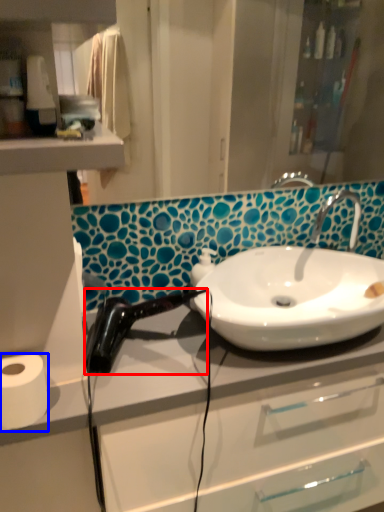
Question: Among these objects, which one is farthest to the camera, hair drier (highlighted by a red box) or toilet paper (highlighted by a blue box)?

Choices:
 (A) hair drier
 (B) toilet paper

Answer: (A)